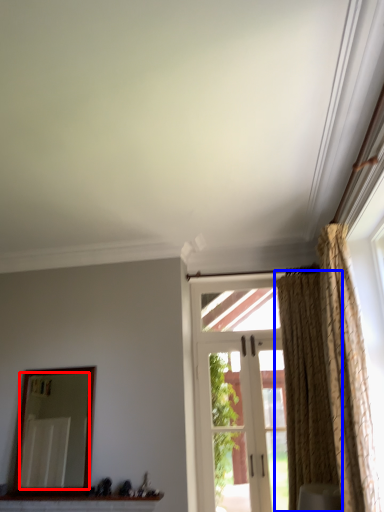
Question: Which of the following is the closest to the observer, mirror (highlighted by a red box) or curtain (highlighted by a blue box)?

Choices:
 (A) mirror
 (B) curtain

Answer: (B)